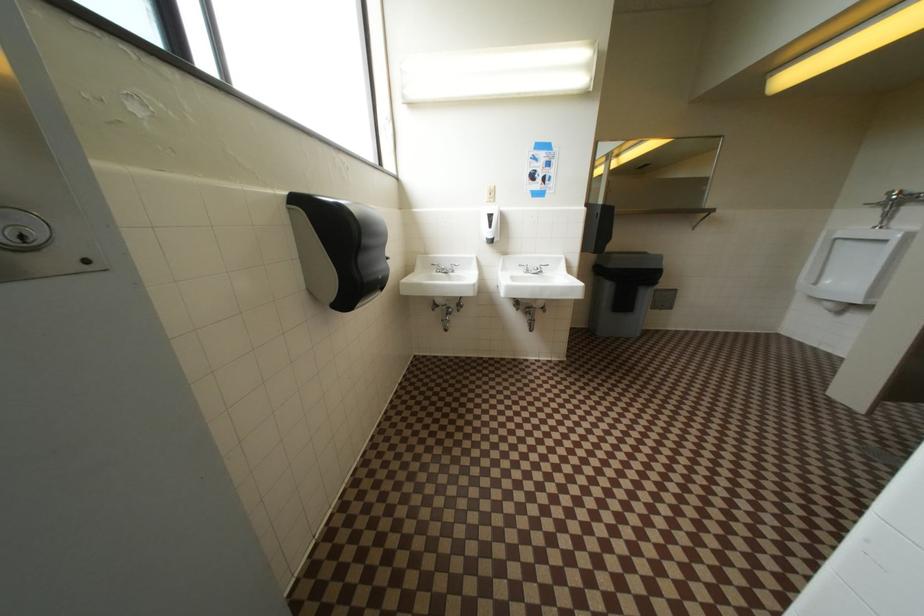
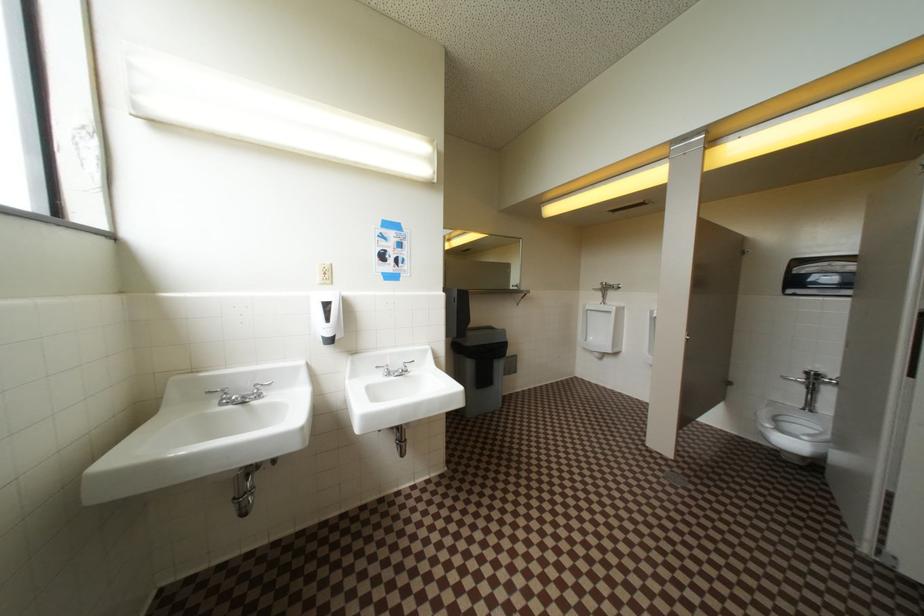
Question: The first image is from the beginning of the video and the second image is from the end. How did the camera likely rotate when shooting the video?

Choices:
 (A) Left
 (B) Right
 (C) Up
 (D) Down

Answer: (B)